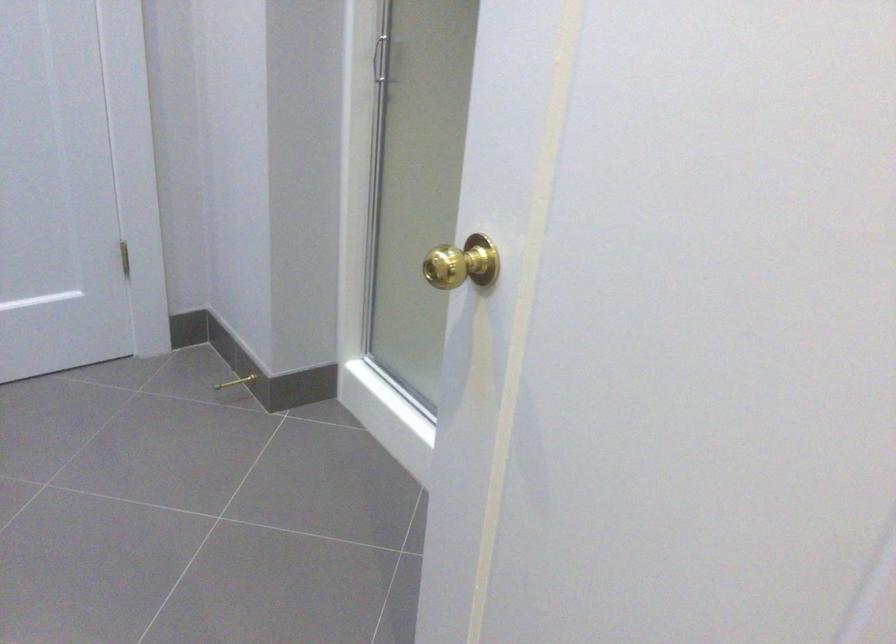
Where is `silver shower handle`? silver shower handle is located at coordinates (388, 61).